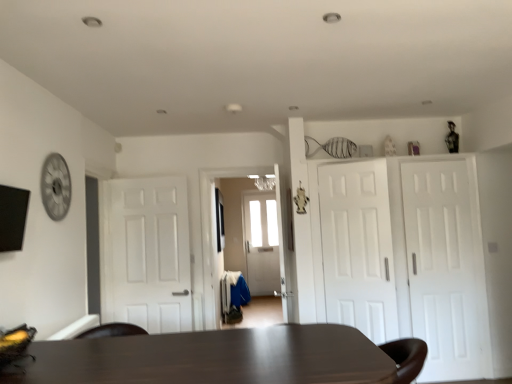
Identify the location of free point above white matte door at right, which is counted as the 1th door, starting from the right (from a real-world perspective). (429, 158).